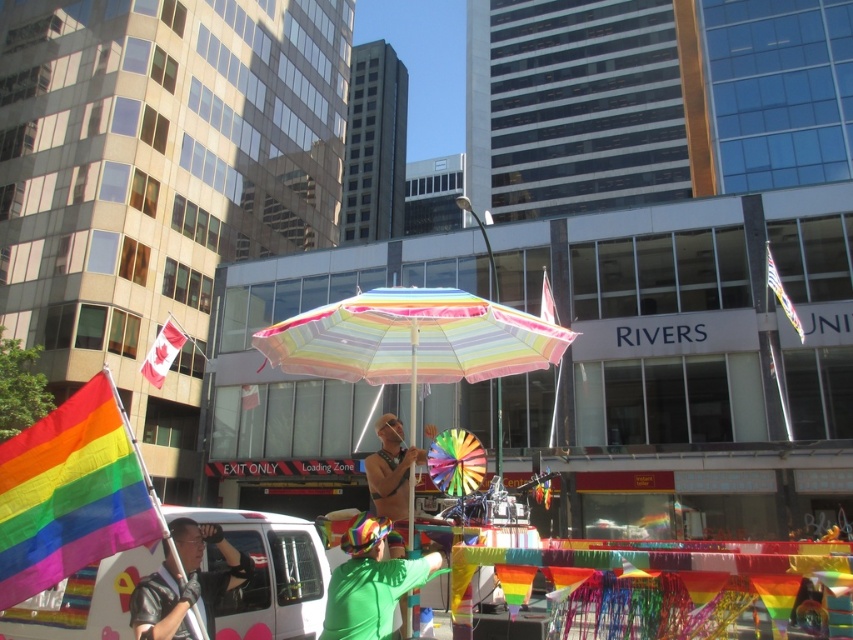
Question: Can you confirm if white fabric flag at upper right is positioned below rainbow fabric flag at center?

Choices:
 (A) no
 (B) yes

Answer: (A)

Question: Which of the following is the farthest from the observer?

Choices:
 (A) red fabric flag at upper left
 (B) leather jacket at lower left
 (C) rainbow fabric flag at center

Answer: (C)

Question: Does rainbow fabric flag at lower left appear under white matte van at center?

Choices:
 (A) no
 (B) yes

Answer: (A)

Question: Is the position of red fabric flag at upper left more distant than that of rainbow fabric flag at center?

Choices:
 (A) yes
 (B) no

Answer: (B)

Question: Which of the following is the farthest from the observer?

Choices:
 (A) (103, 372)
 (B) (373, 602)

Answer: (A)

Question: Considering the real-world distances, which object is farthest from the green matte umbrella at center?

Choices:
 (A) red fabric flag at upper left
 (B) leather jacket at lower left
 (C) rainbow fabric flag at center
 (D) white fabric flag at upper right

Answer: (C)